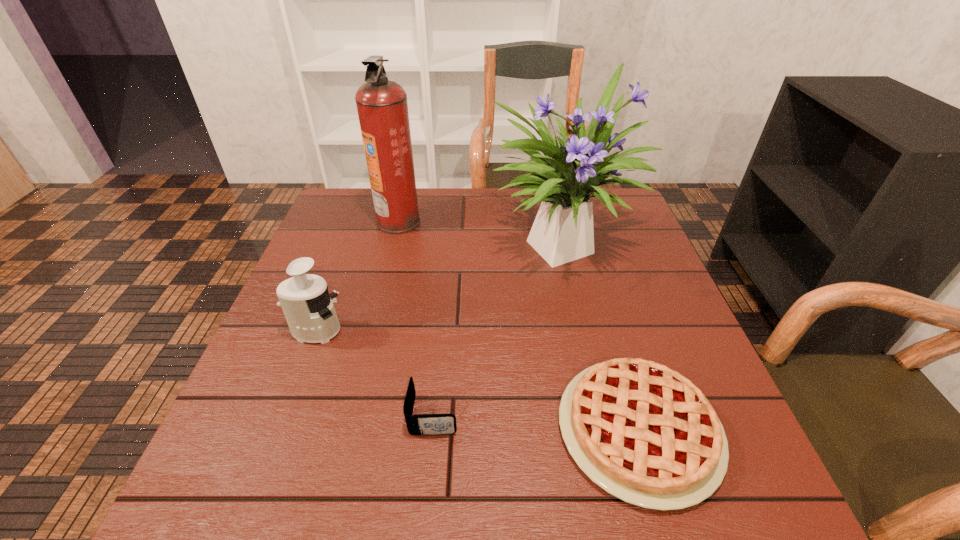
Identify the location of empty location between the pie and the third object from left to right. (536, 422).

The image size is (960, 540). Find the location of `free area in between the fire extinguisher and the third shortest object`. free area in between the fire extinguisher and the third shortest object is located at coordinates (357, 276).

In order to click on free space between the juicer and the wallet in this screenshot , I will do `click(374, 373)`.

Image resolution: width=960 pixels, height=540 pixels. What are the coordinates of `vacant area between the fire extinguisher and the wallet` in the screenshot? It's located at 416,318.

The height and width of the screenshot is (540, 960). Identify the location of vacant area that lies between the fire extinguisher and the third object from left to right. (416, 318).

In order to click on unoccupied area between the third object from left to right and the pie in this screenshot , I will do `click(536, 422)`.

Find the location of a particular element. The image size is (960, 540). empty location between the shortest object and the flower arrangement is located at coordinates (602, 335).

The width and height of the screenshot is (960, 540). What are the coordinates of `object that is the third closest to the pie` in the screenshot? It's located at (306, 303).

Select which object appears as the second closest to the flower arrangement. Please provide its 2D coordinates. Your answer should be formatted as a tuple, i.e. [(x, y)], where the tuple contains the x and y coordinates of a point satisfying the conditions above.

[(644, 433)]

The height and width of the screenshot is (540, 960). Find the location of `free space that satisfies the following two spatial constraints: 1. on the outer surface of the third object from right to left; 2. on the back side of the pie`. free space that satisfies the following two spatial constraints: 1. on the outer surface of the third object from right to left; 2. on the back side of the pie is located at coordinates (432, 430).